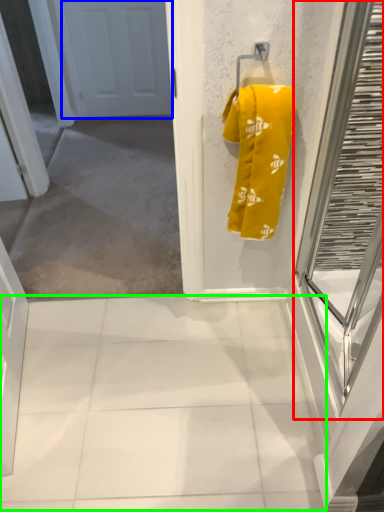
Question: Which object is positioned closest to glass door (highlighted by a red box)? Select from door (highlighted by a blue box) and tile (highlighted by a green box).

Choices:
 (A) door
 (B) tile

Answer: (B)